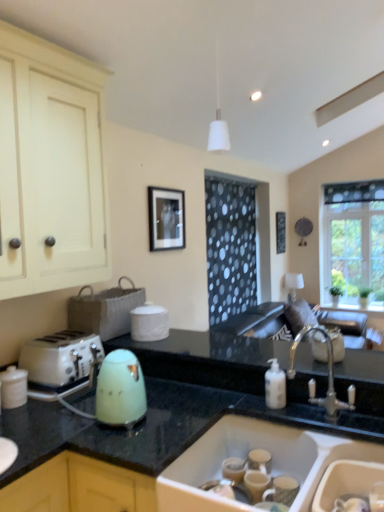
Question: Is white ceramic sink at lower center in contact with clear glass window at upper right?

Choices:
 (A) no
 (B) yes

Answer: (A)

Question: Considering the relative sizes of white ceramic sink at lower center and clear glass window at upper right in the image provided, is white ceramic sink at lower center shorter than clear glass window at upper right?

Choices:
 (A) no
 (B) yes

Answer: (B)

Question: Is clear glass window at upper right completely or partially inside white ceramic sink at lower center?

Choices:
 (A) yes
 (B) no

Answer: (B)

Question: Can you confirm if white ceramic sink at lower center is thinner than clear glass window at upper right?

Choices:
 (A) no
 (B) yes

Answer: (A)

Question: Is white ceramic sink at lower center not inside clear glass window at upper right?

Choices:
 (A) yes
 (B) no

Answer: (A)

Question: Considering the relative positions of white ceramic sink at lower center and clear glass window at upper right in the image provided, is white ceramic sink at lower center to the left of clear glass window at upper right from the viewer's perspective?

Choices:
 (A) yes
 (B) no

Answer: (A)

Question: Is white ceramic sink at lower center taller than white glossy jar at lower left?

Choices:
 (A) no
 (B) yes

Answer: (B)

Question: From a real-world perspective, is white ceramic sink at lower center beneath white glossy jar at lower left?

Choices:
 (A) yes
 (B) no

Answer: (A)

Question: Does white ceramic sink at lower center have a greater width compared to white glossy jar at lower left?

Choices:
 (A) no
 (B) yes

Answer: (B)

Question: From the image's perspective, is white ceramic sink at lower center under white glossy jar at lower left?

Choices:
 (A) yes
 (B) no

Answer: (A)

Question: From a real-world perspective, is white ceramic sink at lower center on top of white glossy jar at lower left?

Choices:
 (A) yes
 (B) no

Answer: (B)

Question: From the image's perspective, does white ceramic sink at lower center appear higher than white glossy jar at lower left?

Choices:
 (A) no
 (B) yes

Answer: (A)

Question: Is the position of white glossy jar at lower left more distant than that of white plastic toaster at left?

Choices:
 (A) yes
 (B) no

Answer: (B)